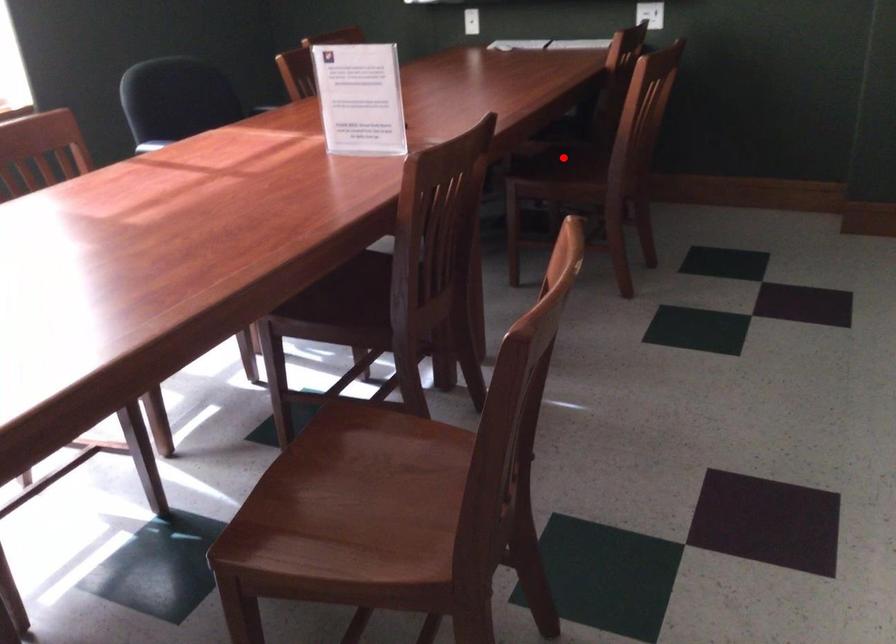
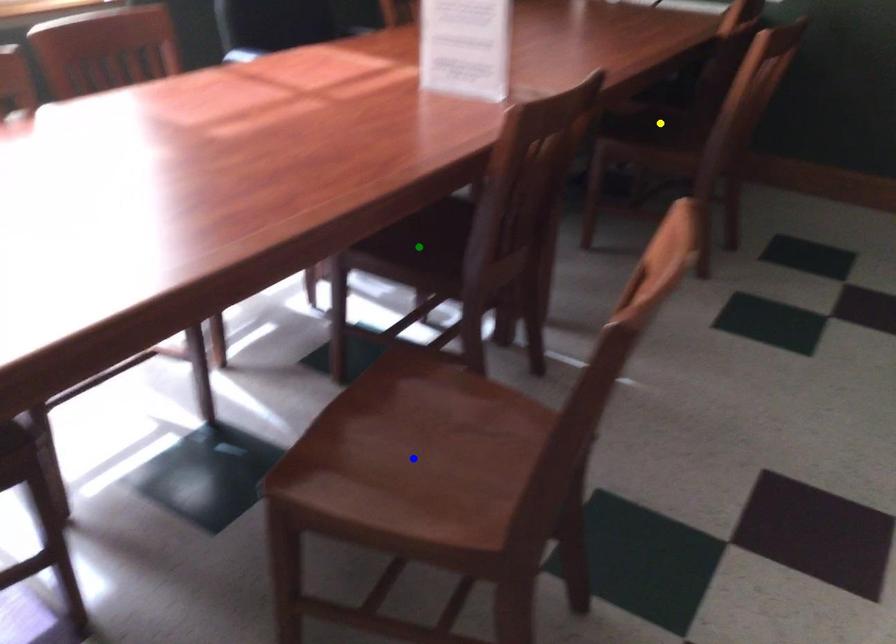
Question: I am providing you with two images of the same scene from different viewpoints. A red point is marked on the first image. You are given multiple points on the second image. Which mark in image 2 goes with the point in image 1?

Choices:
 (A) yellow point
 (B) blue point
 (C) green point

Answer: (A)